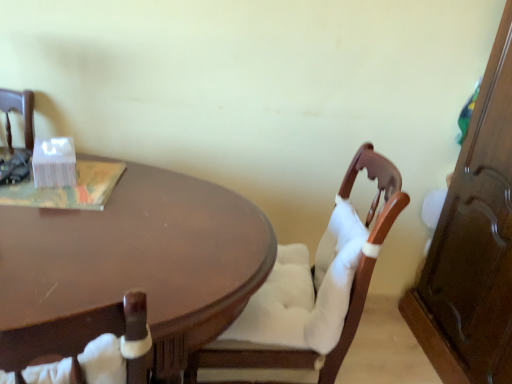
Identify the location of vacant area on top of shiny brown table at center (from a real-world perspective). Image resolution: width=512 pixels, height=384 pixels. (112, 224).